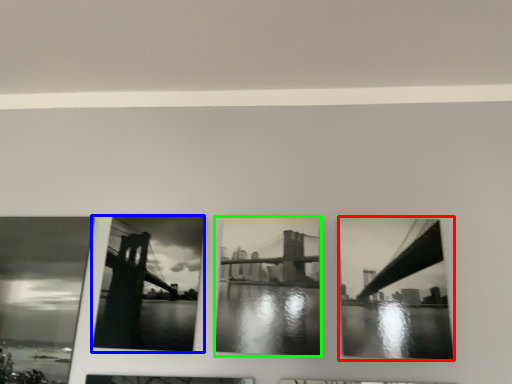
Question: Which object is the closest to the picture frame (highlighted by a red box)? Choose among these: picture frame (highlighted by a blue box) or picture frame (highlighted by a green box).

Choices:
 (A) picture frame
 (B) picture frame

Answer: (B)